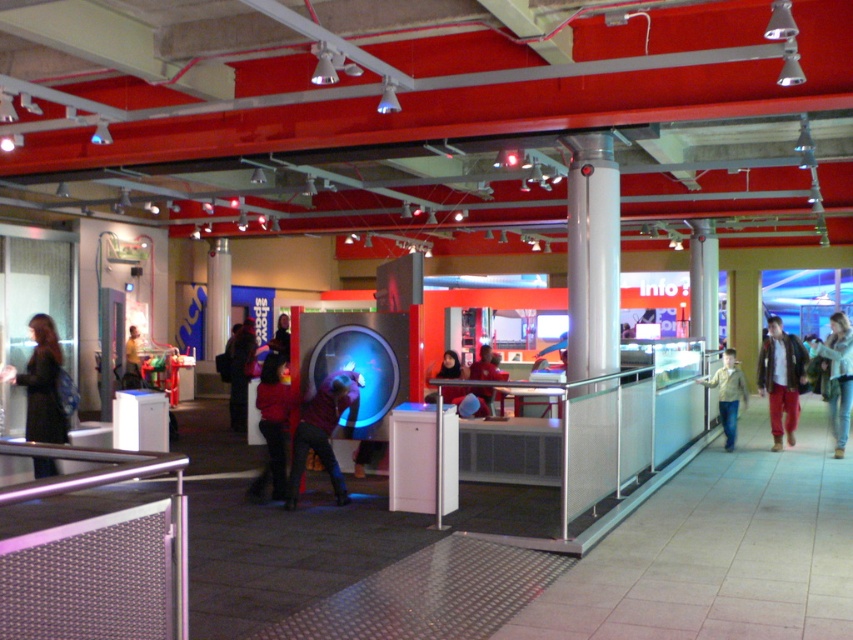
Between matte red sweater at center and matte red shirt at center, which one appears on the right side from the viewer's perspective?

matte red sweater at center

Does matte red sweater at center have a larger size compared to matte red shirt at center?

No, matte red sweater at center is not bigger than matte red shirt at center.

Is point (280, 433) closer to camera compared to point (270, 342)?

Yes, point (280, 433) is closer to viewer.

Locate an element on the screen. matte red sweater at center is located at coordinates (271, 426).

Which is behind, point (843, 426) or point (281, 352)?

The point (281, 352) is behind.

Is denim jacket at right further to camera compared to matte red shirt at center?

Yes, it is behind matte red shirt at center.

Which is behind, point (844, 323) or point (277, 348)?

Positioned behind is point (277, 348).

The image size is (853, 640). Identify the location of denim jacket at right. (837, 376).

Between black leather jacket at left and yellow shirt at center, which one is positioned lower?

yellow shirt at center

Is point (33, 403) more distant than point (125, 385)?

No, (33, 403) is in front of (125, 385).

The width and height of the screenshot is (853, 640). What are the coordinates of `black leather jacket at left` in the screenshot? It's located at (42, 385).